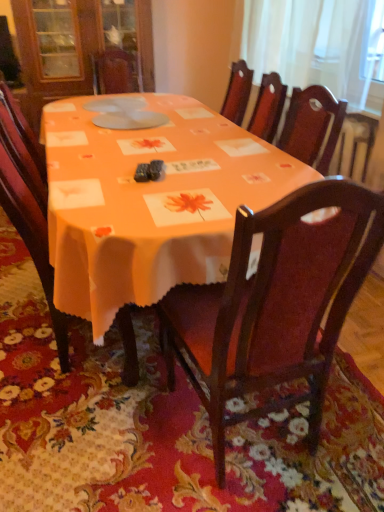
Image resolution: width=384 pixels, height=512 pixels. What are the coordinates of `vacant area on top of orange fabric table at center (from a real-world perspective)` in the screenshot? It's located at (146, 143).